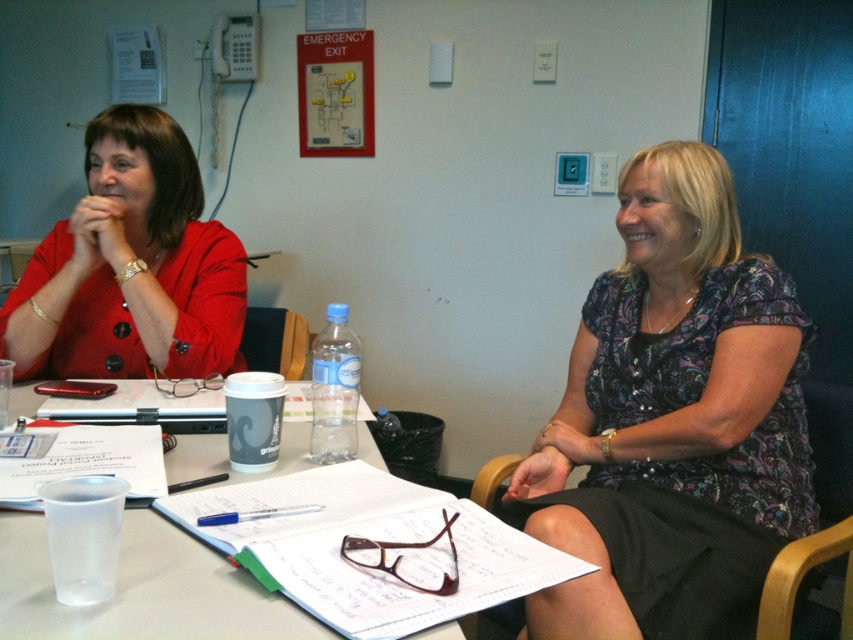
Which is behind, point (585, 612) or point (25, 355)?

Point (25, 355)

Between point (810, 524) and point (48, 282), which one is positioned behind?

Positioned behind is point (48, 282).

What are the coordinates of `patterned fabric blouse at center` in the screenshot? It's located at (674, 420).

Which of these two, matte red blazer at left or clear plastic cup at center, stands shorter?

Standing shorter between the two is clear plastic cup at center.

Is matte red blazer at left thinner than clear plastic cup at center?

Yes.

This screenshot has width=853, height=640. Identify the location of matte red blazer at left. (131, 266).

The height and width of the screenshot is (640, 853). Identify the location of matte red blazer at left. (131, 266).

Does patterned fabric blouse at center have a greater height compared to clear plastic cup at center?

Correct, patterned fabric blouse at center is much taller as clear plastic cup at center.

Is point (630, 586) positioned behind point (149, 621)?

Yes.

Identify the location of patterned fabric blouse at center. (674, 420).